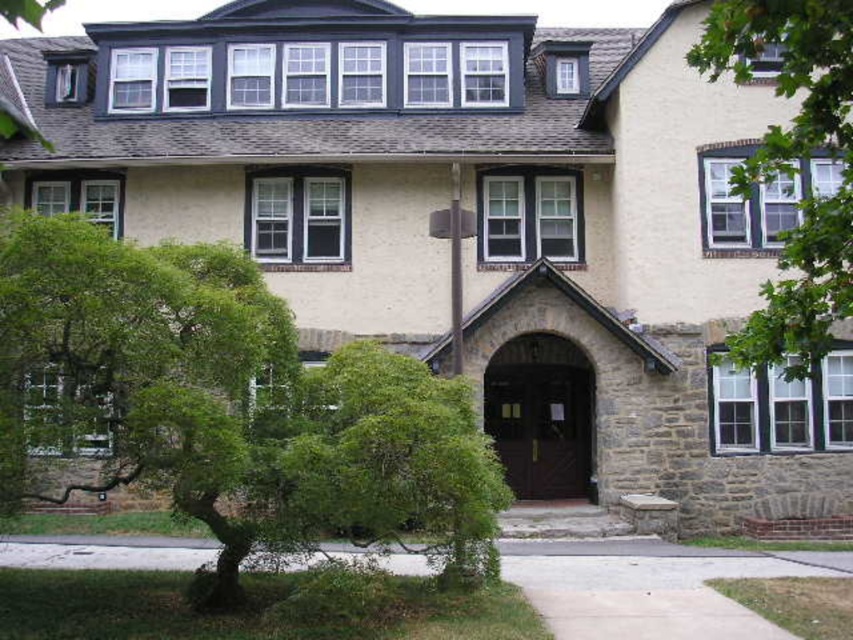
You are standing in front of the house and want to plant a new tree. The existing green leafy tree at left is below the green leafy tree at upper right. Where should you plant the new tree so it doesn not block the view from the upper dormer windows?

The green leafy tree at left is below the green leafy tree at upper right, so planting the new tree between them might block the view. To avoid blocking the view, plant the new tree either to the left of the green leafy tree at left or to the right of the green leafy tree at upper right.